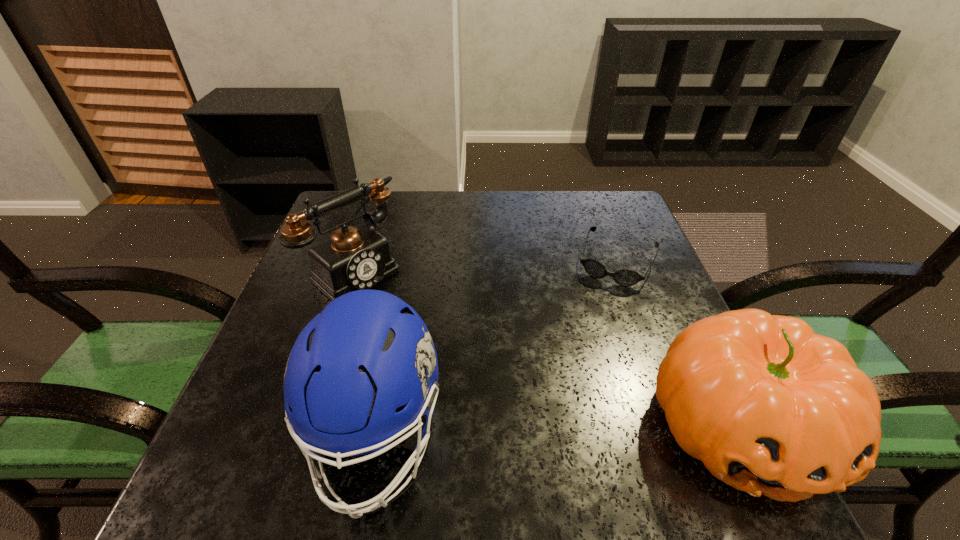
At what (x,y) coordinates should I click in order to perform the action: click on football helmet at the near edge. Please return your answer as a coordinate pair (x, y). Looking at the image, I should click on (364, 371).

Locate an element on the screen. Image resolution: width=960 pixels, height=540 pixels. pumpkin located at the near edge is located at coordinates (770, 407).

Locate an element on the screen. football helmet that is at the left edge is located at coordinates (364, 371).

You are a GUI agent. You are given a task and a screenshot of the screen. Output one action in this format:
    pyautogui.click(x=<x>, y=<y>)
    Task: Click on the telephone that is positioned at the left edge
    Image resolution: width=960 pixels, height=540 pixels.
    Given the screenshot: What is the action you would take?
    pyautogui.click(x=355, y=258)

At what (x,y) coordinates should I click in order to perform the action: click on pumpkin that is at the right edge. Please return your answer as a coordinate pair (x, y). The height and width of the screenshot is (540, 960). Looking at the image, I should click on (770, 407).

At what (x,y) coordinates should I click in order to perform the action: click on sunglasses that is at the right edge. Please return your answer as a coordinate pair (x, y). Image resolution: width=960 pixels, height=540 pixels. Looking at the image, I should click on (625, 277).

I want to click on object positioned at the near left corner, so 364,371.

The width and height of the screenshot is (960, 540). I want to click on object at the near right corner, so click(x=770, y=407).

Where is `vacant region at the far edge of the desktop`? vacant region at the far edge of the desktop is located at coordinates (457, 205).

Locate an element on the screen. This screenshot has width=960, height=540. vacant space at the right edge is located at coordinates (653, 253).